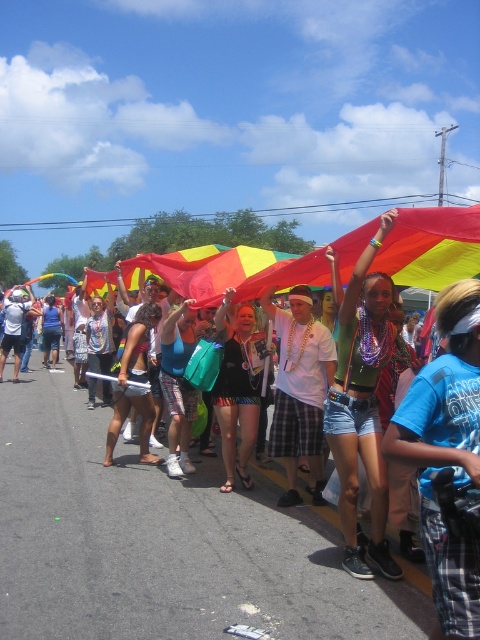
Question: Which point is closer to the camera?

Choices:
 (A) black mesh tank top at center
 (B) blue cotton shirt at center

Answer: (B)

Question: Can you confirm if blue cotton shirt at center is positioned above white matte t-shirt at center?

Choices:
 (A) yes
 (B) no

Answer: (A)

Question: Is the position of white matte t-shirt at center less distant than that of black mesh tank top at center?

Choices:
 (A) yes
 (B) no

Answer: (A)

Question: Estimate the real-world distances between objects in this image. Which object is closer to the green fabric top at center?

Choices:
 (A) white matte t-shirt at center
 (B) black mesh tank top at center

Answer: (A)

Question: Which of the following is the farthest from the observer?

Choices:
 (A) black mesh tank top at center
 (B) blue cotton shirt at center
 (C) white matte t-shirt at center
 (D) green fabric top at center

Answer: (A)

Question: Observing the image, what is the correct spatial positioning of blue cotton shirt at center in reference to green fabric top at center?

Choices:
 (A) left
 (B) right

Answer: (A)